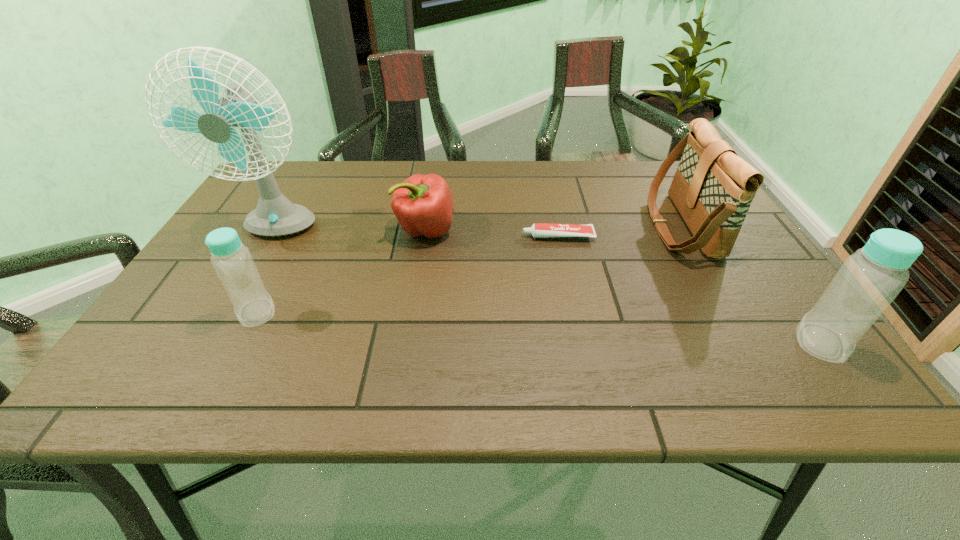
At what (x,y) coordinates should I click in order to perform the action: click on vacant space located 0.140m on the left of the left bottle. Please return your answer as a coordinate pair (x, y). Looking at the image, I should click on (169, 313).

You are a GUI agent. You are given a task and a screenshot of the screen. Output one action in this format:
    pyautogui.click(x=<x>, y=<y>)
    Task: Click on the vacant space located on the back of the right bottle
    This screenshot has width=960, height=540.
    Given the screenshot: What is the action you would take?
    pyautogui.click(x=762, y=262)

Where is `vacant space located on the front-facing side of the second object from right to left`? vacant space located on the front-facing side of the second object from right to left is located at coordinates (595, 226).

This screenshot has width=960, height=540. Identify the location of free space located on the front-facing side of the second object from right to left. (595, 226).

Locate an element on the screen. vacant region located 0.150m on the front-facing side of the second object from right to left is located at coordinates (595, 226).

Where is `free region located on the right of the fourth object from right to left`? The image size is (960, 540). free region located on the right of the fourth object from right to left is located at coordinates (513, 230).

Where is `vacant space located on the front-facing side of the tallest object`? This screenshot has height=540, width=960. vacant space located on the front-facing side of the tallest object is located at coordinates (208, 347).

At what (x,y) coordinates should I click in order to perform the action: click on vacant area situated at the nozzle of the third object from right to left. Please return your answer as a coordinate pair (x, y). The height and width of the screenshot is (540, 960). Looking at the image, I should click on (455, 237).

Locate an element on the screen. blank space located at the nozzle of the third object from right to left is located at coordinates (392, 237).

This screenshot has height=540, width=960. Find the location of `free space located 0.350m at the nozzle of the third object from right to left`. free space located 0.350m at the nozzle of the third object from right to left is located at coordinates (383, 237).